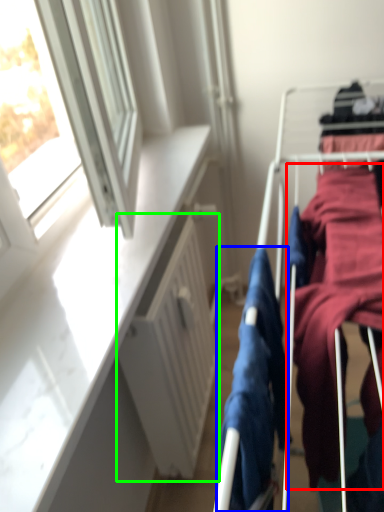
Question: Based on their relative distances, which object is nearer to clothing (highlighted by a red box)? Choose from clothing (highlighted by a blue box) and radiator (highlighted by a green box).

Choices:
 (A) clothing
 (B) radiator

Answer: (A)